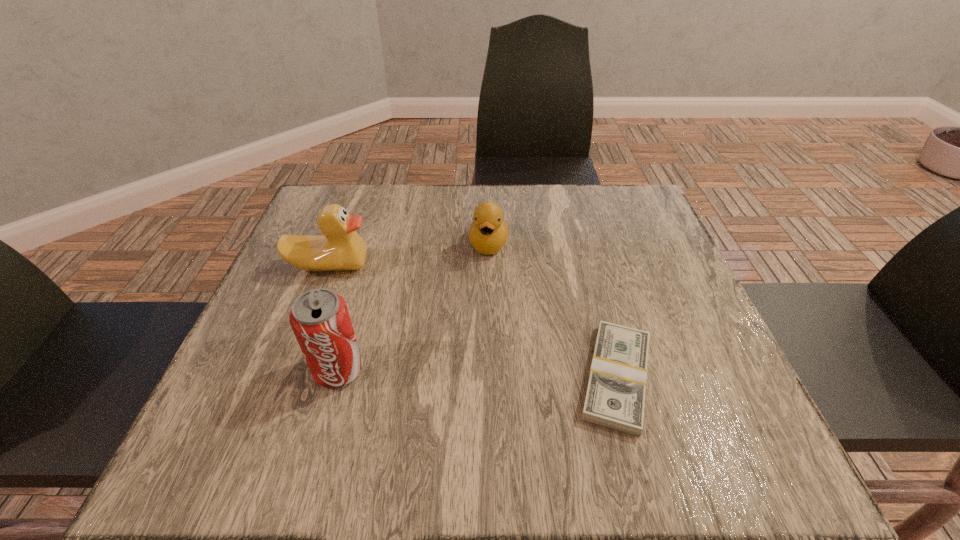
Find the location of `free space that satisfies the following two spatial constraints: 1. on the front side of the second tallest object; 2. on the left side of the shortest object`. free space that satisfies the following two spatial constraints: 1. on the front side of the second tallest object; 2. on the left side of the shortest object is located at coordinates (288, 377).

The image size is (960, 540). Find the location of `vacant space that satisfies the following two spatial constraints: 1. on the front side of the dollar; 2. on the right side of the soda can`. vacant space that satisfies the following two spatial constraints: 1. on the front side of the dollar; 2. on the right side of the soda can is located at coordinates (337, 377).

Locate an element on the screen. The image size is (960, 540). free space that satisfies the following two spatial constraints: 1. on the front side of the duck; 2. on the right side of the dollar is located at coordinates (288, 377).